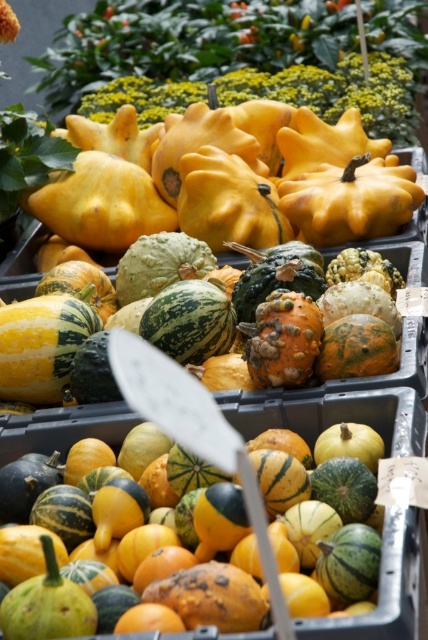
You are standing at the entrance of the market and want to find the speckled orange squash at center. According to the coordinates provided, where should you look relative to the image frame?

The speckled orange squash at center is located at point coordinates 0.867 on the x axis and 0.371 on the y axis, so you should look towards the right side and slightly below the center of the image frame.